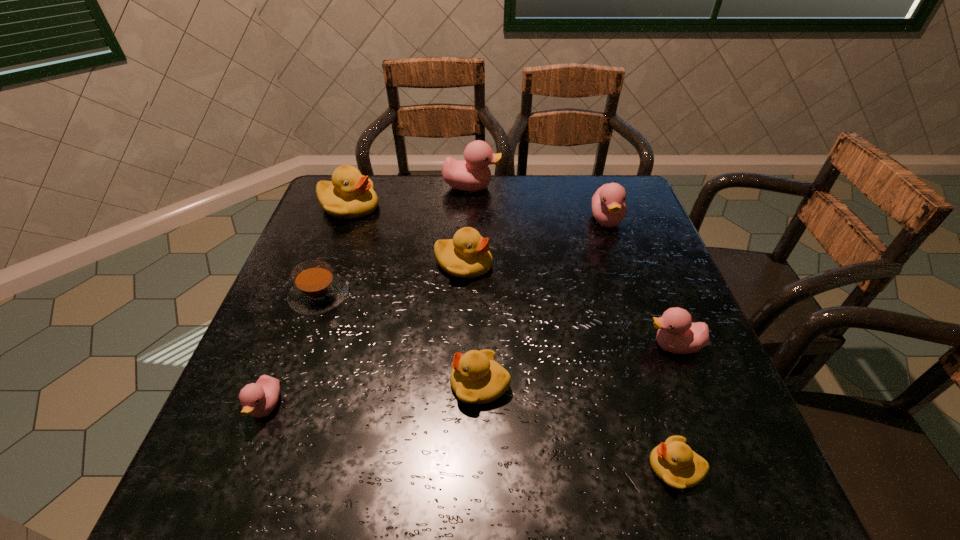
The height and width of the screenshot is (540, 960). I want to click on the farthest pink duckling, so click(x=472, y=174).

Find the location of a particular element. The width and height of the screenshot is (960, 540). the third pink duckling from right to left is located at coordinates (472, 174).

This screenshot has height=540, width=960. Identify the location of the biggest yellow duckling. (350, 195).

You are a GUI agent. You are given a task and a screenshot of the screen. Output one action in this format:
    pyautogui.click(x=<x>, y=<y>)
    Task: Click on the farthest yellow duckling
    This screenshot has width=960, height=540.
    Given the screenshot: What is the action you would take?
    [350, 195]

Where is `the second biggest pink duckling`? The height and width of the screenshot is (540, 960). the second biggest pink duckling is located at coordinates (609, 208).

The width and height of the screenshot is (960, 540). What are the coordinates of `the third nearest yellow duckling` in the screenshot? It's located at (467, 255).

I want to click on the fifth nearest duckling, so point(467,255).

Locate an element on the screen. the third farthest pink duckling is located at coordinates (677, 334).

Identify the location of the third farthest yellow duckling. This screenshot has height=540, width=960. (476, 378).

Identify the location of the smallest pink duckling. The image size is (960, 540). (259, 399).